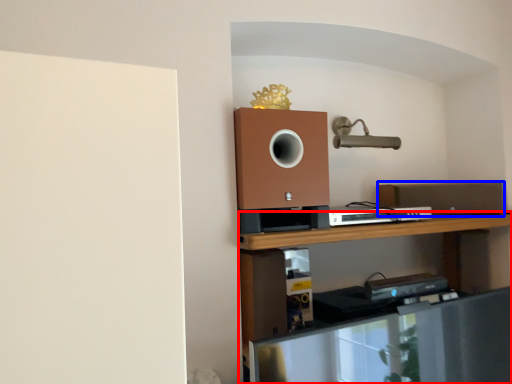
Question: Which object appears farthest to the camera in this image, shelf (highlighted by a red box) or speaker (highlighted by a blue box)?

Choices:
 (A) shelf
 (B) speaker

Answer: (B)